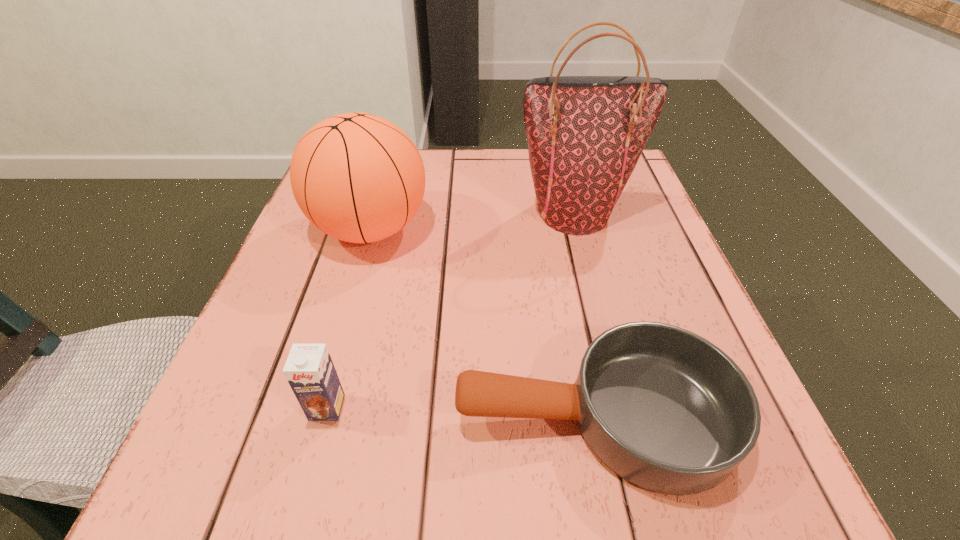
Locate an element on the screen. This screenshot has height=540, width=960. handbag present at the far edge is located at coordinates (585, 134).

Locate an element on the screen. basketball located in the far edge section of the desktop is located at coordinates (357, 177).

At what (x,y) coordinates should I click in order to perform the action: click on object positioned at the near edge. Please return your answer as a coordinate pair (x, y). This screenshot has height=540, width=960. Looking at the image, I should click on (665, 409).

What are the coordinates of `basketball located in the left edge section of the desktop` in the screenshot? It's located at (357, 177).

This screenshot has width=960, height=540. What are the coordinates of `chocolate milk that is positioned at the left edge` in the screenshot? It's located at (309, 370).

Locate an element on the screen. handbag present at the right edge is located at coordinates (585, 134).

This screenshot has height=540, width=960. Identify the location of pan that is at the right edge. (665, 409).

This screenshot has height=540, width=960. Find the location of `object situated at the far left corner`. object situated at the far left corner is located at coordinates (357, 177).

What are the coordinates of `object present at the far right corner` in the screenshot? It's located at (585, 134).

The image size is (960, 540). I want to click on object located at the near right corner, so click(665, 409).